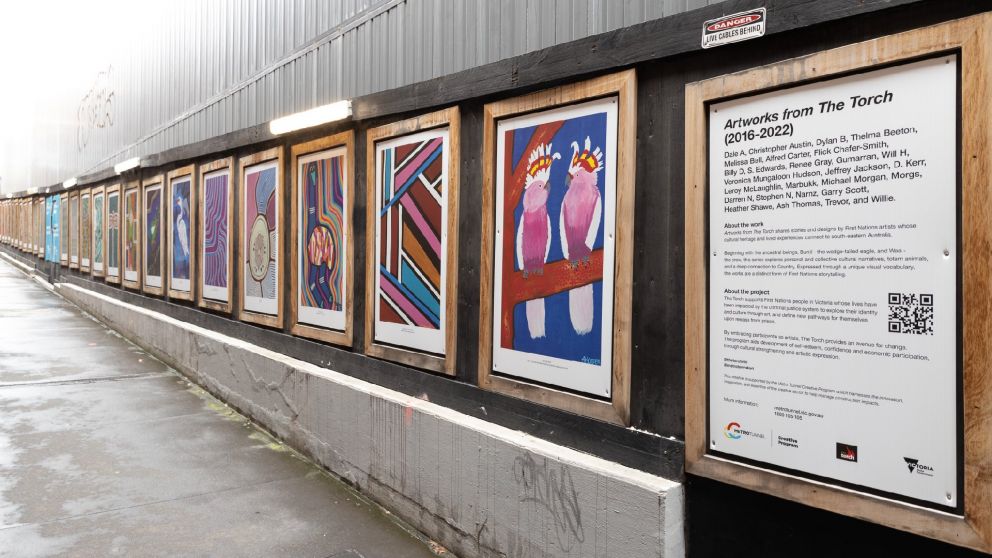
Locate an element on the screen. second nearest artwork is located at coordinates (405, 243).